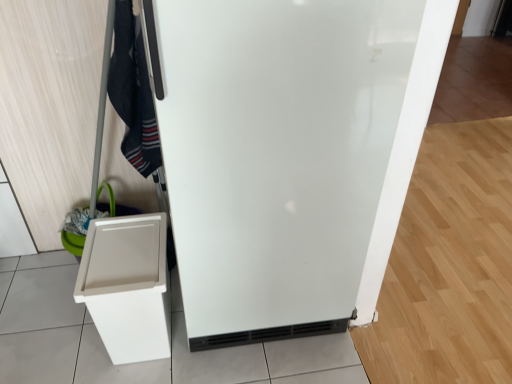
Question: Considering their positions, is white plastic bin at lower left located in front of or behind white glossy refrigerator at center?

Choices:
 (A) behind
 (B) front

Answer: (A)

Question: Is white plastic bin at lower left to the left or to the right of white glossy refrigerator at center in the image?

Choices:
 (A) left
 (B) right

Answer: (A)

Question: Considering the real-world distances, which object is closest to the black cotton scarf at upper left?

Choices:
 (A) white plastic bin at lower left
 (B) white glossy refrigerator at center

Answer: (A)

Question: Considering the real-world distances, which object is farthest from the black cotton scarf at upper left?

Choices:
 (A) white plastic bin at lower left
 (B) white glossy refrigerator at center

Answer: (B)